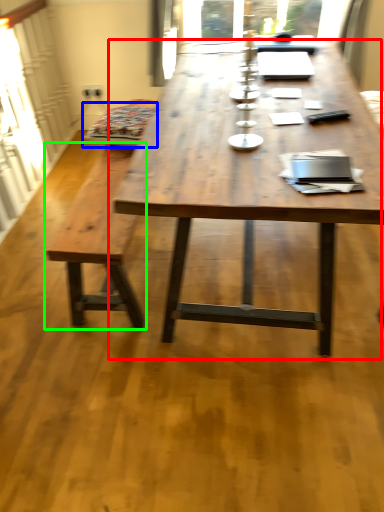
Question: Which object is positioned closest to coffee table (highlighted by a red box)? Select from swivel chair (highlighted by a blue box) and bench (highlighted by a green box).

Choices:
 (A) swivel chair
 (B) bench

Answer: (B)